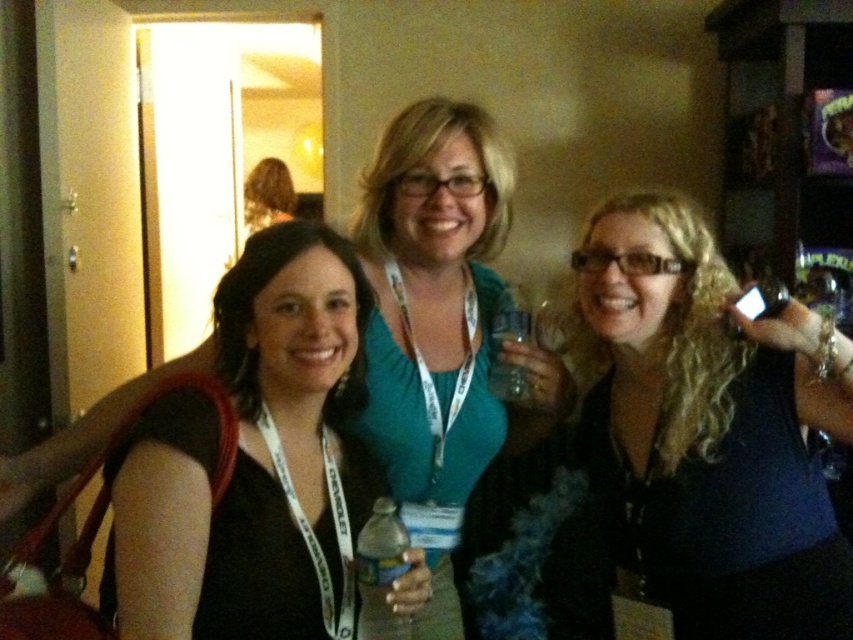
You are a photographer adjusting your camera settings to focus on the black fabric at center and the translucent plastic water bottle at center. Which object should you focus on first to ensure both are in focus?

The black fabric at center is closer to the viewer than the translucent plastic water bottle at center, so focus on the black fabric at center first to ensure both are in focus.

Based on the photo, you are standing at the point labeled point (674, 560) and want to move to the center of the room. The room is 5 meters wide. Can you walk straight to the center without any obstacles?

The distance between the point labeled point (674, 560) and the center of the room is 1.28 meters. Since the room is 5 meters wide, there is enough space to walk straight to the center without any obstacles.